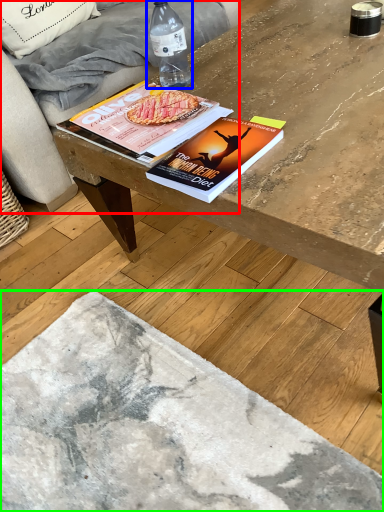
Question: Which object is the closest to the studio couch (highlighted by a red box)? Choose among these: bottle (highlighted by a blue box) or concrete (highlighted by a green box).

Choices:
 (A) bottle
 (B) concrete

Answer: (A)